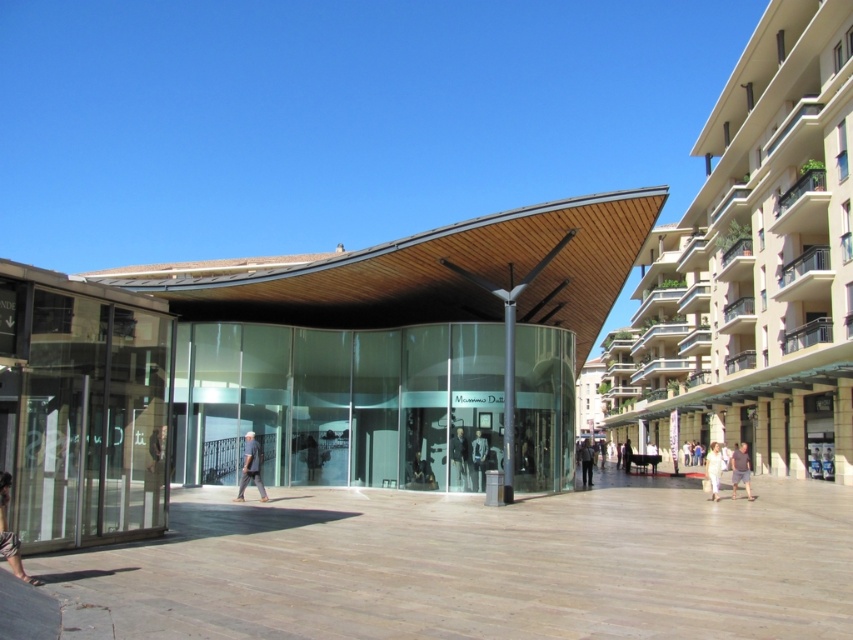
Question: Which object is closer to the camera taking this photo?

Choices:
 (A) light brown shorts at center
 (B) white fabric person at center
 (C) dark brown leather jacket at center
 (D) light blue jeans at center

Answer: (D)

Question: Which of these objects is positioned closest to the light brown leather shoes at lower left?

Choices:
 (A) light brown leather jacket at center
 (B) beige stone building at center

Answer: (A)

Question: Is beige stone building at center positioned at the back of light brown leather jacket at center?

Choices:
 (A) yes
 (B) no

Answer: (B)

Question: Can you confirm if light blue jeans at center is positioned to the left of dark gray jacket at center?

Choices:
 (A) yes
 (B) no

Answer: (A)

Question: Which of the following is the farthest from the observer?

Choices:
 (A) light brown leather jacket at center
 (B) dark gray fabric mannequin at center
 (C) light blue jeans at center

Answer: (A)

Question: Does light blue jeans at center appear on the left side of dark gray jacket at center?

Choices:
 (A) no
 (B) yes

Answer: (B)